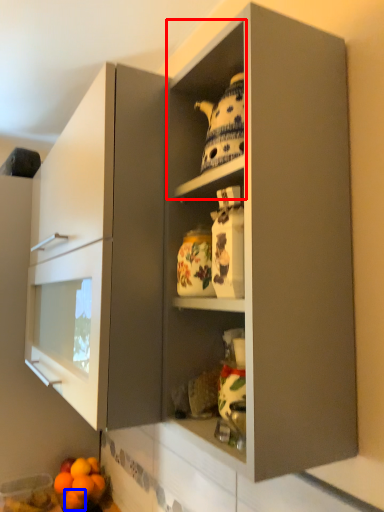
Question: Which object appears farthest to the camera in this image, cabinet (highlighted by a red box) or orange (highlighted by a blue box)?

Choices:
 (A) cabinet
 (B) orange

Answer: (B)